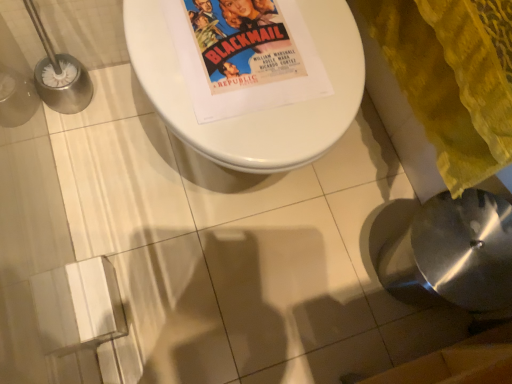
Question: In terms of width, does yellow textured blanket at lower right look wider or thinner when compared to white glossy toilet at center?

Choices:
 (A) thin
 (B) wide

Answer: (A)

Question: Do you think yellow textured blanket at lower right is within white glossy toilet at center, or outside of it?

Choices:
 (A) outside
 (B) inside

Answer: (A)

Question: Which is nearer to the yellow textured blanket at lower right?

Choices:
 (A) satin silver sink at lower right
 (B) white glossy toilet at center

Answer: (A)

Question: Estimate the real-world distances between objects in this image. Which object is farther from the yellow textured blanket at lower right?

Choices:
 (A) satin silver sink at lower right
 (B) white glossy toilet at center

Answer: (B)